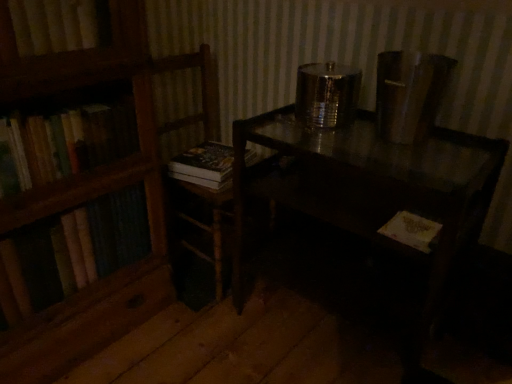
The height and width of the screenshot is (384, 512). What do you see at coordinates (201, 90) in the screenshot?
I see `wooden chair at left` at bounding box center [201, 90].

Identify the location of hardcover book at center, the second book viewed from the right. (204, 162).

This screenshot has height=384, width=512. Find the location of `yellow paper book at lower right, acting as the 2th book starting from the back`. yellow paper book at lower right, acting as the 2th book starting from the back is located at coordinates (412, 231).

Describe the element at coordinates (412, 231) in the screenshot. I see `yellow paper book at lower right, which ranks as the 1th book in right-to-left order` at that location.

Identify the location of wooden chair at left. (201, 90).

Looking at this image, is hardcover book at center, the second book viewed from the right, facing away from shiny dark wood table at center?

No, hardcover book at center, the second book viewed from the right, is not facing away from shiny dark wood table at center.

Is hardcover book at center, placed as the first book when sorted from back to front, to the left of shiny dark wood table at center from the viewer's perspective?

Correct, you'll find hardcover book at center, placed as the first book when sorted from back to front, to the left of shiny dark wood table at center.

From a real-world perspective, is hardcover book at center, which is the 2th book in front-to-back order, under shiny dark wood table at center?

Actually, hardcover book at center, which is the 2th book in front-to-back order, is physically above shiny dark wood table at center in the real world.

Where is `book behind the yellow paper book at lower right, the 1th book positioned from the bottom`? book behind the yellow paper book at lower right, the 1th book positioned from the bottom is located at coordinates (204, 162).

Can you confirm if hardcover book at center, the 1th book when ordered from top to bottom, is positioned to the right of yellow paper book at lower right, which is the 2th book in top-to-bottom order?

In fact, hardcover book at center, the 1th book when ordered from top to bottom, is to the left of yellow paper book at lower right, which is the 2th book in top-to-bottom order.

Which is in front, point (212, 156) or point (413, 229)?

The point (413, 229) is in front.

Based on the photo, is hardcover book at center, the second book viewed from the right, placed right next to yellow paper book at lower right, acting as the 2th book starting from the back?

No, hardcover book at center, the second book viewed from the right, is not in contact with yellow paper book at lower right, acting as the 2th book starting from the back.

From a real-world perspective, which is physically below, hardcover book at center, which is the 2th book in front-to-back order, or wooden chair at left?

wooden chair at left.

Is hardcover book at center, which is the 2th book in front-to-back order, situated inside wooden chair at left or outside?

hardcover book at center, which is the 2th book in front-to-back order, can be found inside wooden chair at left.

Considering the relative sizes of hardcover book at center, the 1th book when ordered from top to bottom, and wooden chair at left in the image provided, is hardcover book at center, the 1th book when ordered from top to bottom, taller than wooden chair at left?

No, hardcover book at center, the 1th book when ordered from top to bottom, is not taller than wooden chair at left.

Considering the points (227, 168) and (216, 87), which point is in front, point (227, 168) or point (216, 87)?

The point (227, 168) is closer.

Could you measure the distance between yellow paper book at lower right, the second book positioned from the left, and shiny dark wood table at center?

9.39 inches.

Is yellow paper book at lower right, which ranks as the 1th book in right-to-left order, shorter than shiny dark wood table at center?

Yes, yellow paper book at lower right, which ranks as the 1th book in right-to-left order, is shorter than shiny dark wood table at center.

From the image's perspective, which is above, yellow paper book at lower right, the second book positioned from the left, or shiny dark wood table at center?

yellow paper book at lower right, the second book positioned from the left, is shown above in the image.

Considering the sizes of objects yellow paper book at lower right, the second book positioned from the left, and shiny dark wood table at center in the image provided, who is wider, yellow paper book at lower right, the second book positioned from the left, or shiny dark wood table at center?

With larger width is shiny dark wood table at center.

Is shiny dark wood table at center completely or partially outside of hardcover book at center, which is the 2th book in front-to-back order?

Yes, shiny dark wood table at center is outside of hardcover book at center, which is the 2th book in front-to-back order.

Does shiny dark wood table at center have a greater height compared to hardcover book at center, the 1th book in the left-to-right sequence?

Correct, shiny dark wood table at center is much taller as hardcover book at center, the 1th book in the left-to-right sequence.

Which is more to the left, shiny dark wood table at center or hardcover book at center, the second book viewed from the right?

hardcover book at center, the second book viewed from the right.

How distant is wooden chair at left from hardcover book at center, placed as the first book when sorted from back to front?

wooden chair at left and hardcover book at center, placed as the first book when sorted from back to front, are 10.79 inches apart from each other.

This screenshot has width=512, height=384. What are the coordinates of `book above the wooden chair at left (from the image's perspective)` in the screenshot? It's located at (204, 162).

Considering the relative sizes of wooden chair at left and hardcover book at center, the 1th book when ordered from top to bottom, in the image provided, is wooden chair at left wider than hardcover book at center, the 1th book when ordered from top to bottom,?

Yes.

Does wooden chair at left appear on the left side of hardcover book at center, placed as the first book when sorted from back to front?

Yes, wooden chair at left is to the left of hardcover book at center, placed as the first book when sorted from back to front.

Is shiny dark wood table at center closer to the viewer compared to yellow paper book at lower right, which ranks as the first book in front-to-back order?

Yes, shiny dark wood table at center is closer to the viewer.

Considering the points (419, 183) and (389, 232), which point is in front, point (419, 183) or point (389, 232)?

The point (419, 183) is closer to the camera.

Between shiny dark wood table at center and yellow paper book at lower right, which is the 2th book in top-to-bottom order, which one has smaller width?

yellow paper book at lower right, which is the 2th book in top-to-bottom order, is thinner.

Are shiny dark wood table at center and yellow paper book at lower right, acting as the 2th book starting from the back, beside each other?

No, shiny dark wood table at center is not beside yellow paper book at lower right, acting as the 2th book starting from the back.

This screenshot has height=384, width=512. I want to click on book that is the 1st object above the shiny dark wood table at center (from a real-world perspective), so click(204, 162).

You are a GUI agent. You are given a task and a screenshot of the screen. Output one action in this format:
    pyautogui.click(x=<x>, y=<y>)
    Task: Click on the book in front of the hardcover book at center, the 1th book when ordered from top to bottom
    The width and height of the screenshot is (512, 384).
    Given the screenshot: What is the action you would take?
    pyautogui.click(x=412, y=231)

Considering their positions, is shiny dark wood table at center positioned closer to yellow paper book at lower right, the 1th book positioned from the bottom, than hardcover book at center, the second book viewed from the right?

Based on the image, shiny dark wood table at center appears to be nearer to yellow paper book at lower right, the 1th book positioned from the bottom.

Estimate the real-world distances between objects in this image. Which object is further from wooden chair at left, shiny dark wood table at center or hardcover book at center, the 1th book when ordered from top to bottom?

shiny dark wood table at center lies further to wooden chair at left than the other object.

When comparing their distances from shiny dark wood table at center, does yellow paper book at lower right, the second book positioned from the left, or wooden chair at left seem closer?

yellow paper book at lower right, the second book positioned from the left.

Based on the photo, looking at the image, which one is located further to yellow paper book at lower right, which ranks as the 1th book in right-to-left order, wooden chair at left or hardcover book at center, the 1th book when ordered from top to bottom?

wooden chair at left is further to yellow paper book at lower right, which ranks as the 1th book in right-to-left order.

From the image, which object appears to be nearer to wooden chair at left, yellow paper book at lower right, acting as the 2th book starting from the back, or shiny dark wood table at center?

The object closer to wooden chair at left is shiny dark wood table at center.

Which object lies nearer to the anchor point shiny dark wood table at center, yellow paper book at lower right, the 1th book positioned from the bottom, or hardcover book at center, the second book viewed from the right?

yellow paper book at lower right, the 1th book positioned from the bottom, is closer to shiny dark wood table at center.

Looking at the image, which one is located closer to hardcover book at center, placed as the first book when sorted from back to front, wooden chair at left or yellow paper book at lower right, which ranks as the 1th book in right-to-left order?

wooden chair at left lies closer to hardcover book at center, placed as the first book when sorted from back to front, than the other object.

When comparing their distances from wooden chair at left, does shiny dark wood table at center or yellow paper book at lower right, the 1th book positioned from the bottom, seem closer?

shiny dark wood table at center is positioned closer to the anchor wooden chair at left.

In order to click on book between wooden chair at left and yellow paper book at lower right, the second book positioned from the left, in the horizontal direction in this screenshot , I will do `click(204, 162)`.

Locate an element on the screen. This screenshot has height=384, width=512. armchair between shiny dark wood table at center and hardcover book at center, the 1th book when ordered from top to bottom, from front to back is located at coordinates (201, 90).

Where is `table located between wooden chair at left and yellow paper book at lower right, which ranks as the 1th book in right-to-left order, in the left-right direction`? This screenshot has height=384, width=512. table located between wooden chair at left and yellow paper book at lower right, which ranks as the 1th book in right-to-left order, in the left-right direction is located at coordinates (371, 192).

Identify the location of book between shiny dark wood table at center and hardcover book at center, placed as the first book when sorted from back to front, in the front-back direction. Image resolution: width=512 pixels, height=384 pixels. (412, 231).